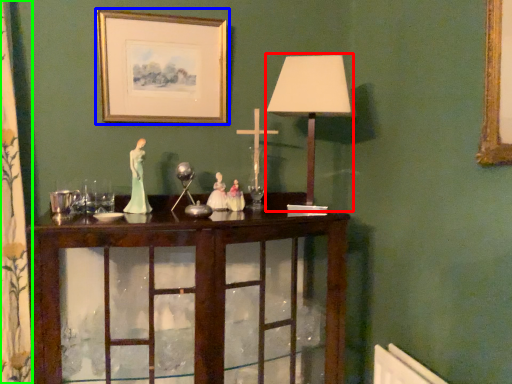
Question: Considering the real-world distances, which object is closest to table lamp (highlighted by a red box)? picture frame (highlighted by a blue box) or curtain (highlighted by a green box).

Choices:
 (A) picture frame
 (B) curtain

Answer: (A)